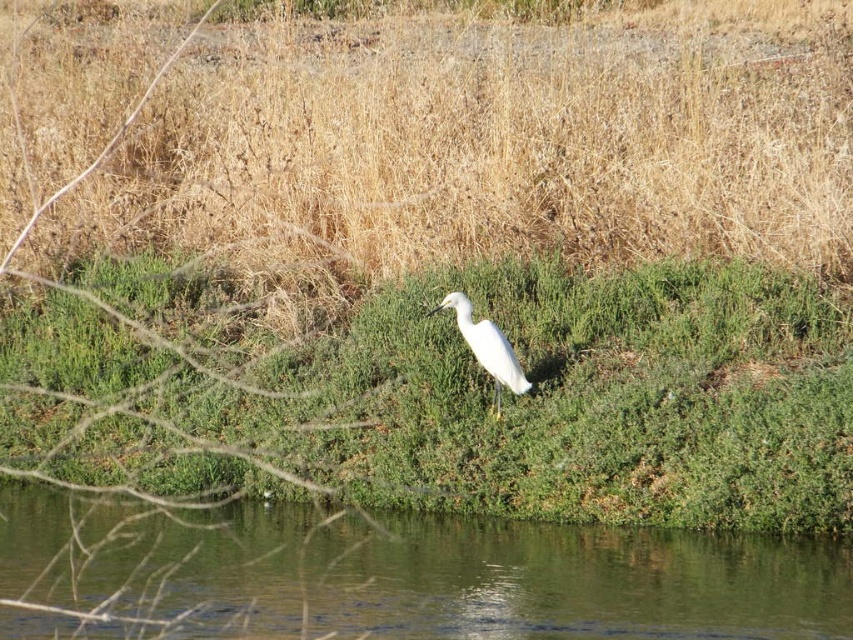
Question: Can you confirm if green grassy riverbank at center is smaller than white smooth bird at center?

Choices:
 (A) yes
 (B) no

Answer: (B)

Question: Does green grassy riverbank at center have a larger size compared to white smooth bird at center?

Choices:
 (A) yes
 (B) no

Answer: (A)

Question: Does green grassy riverbank at center come in front of white smooth bird at center?

Choices:
 (A) no
 (B) yes

Answer: (B)